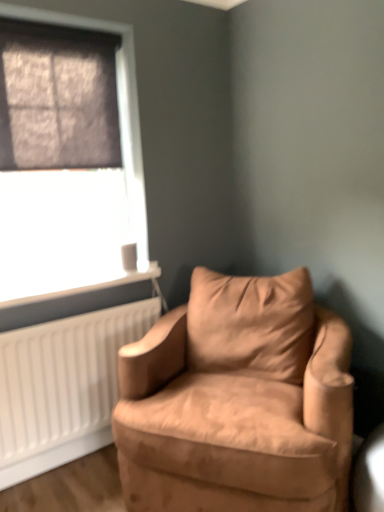
Question: Visually, is suede-like tan armchair at center positioned to the left or to the right of dark matte window screen at upper left?

Choices:
 (A) right
 (B) left

Answer: (A)

Question: Is suede-like tan armchair at center taller or shorter than dark matte window screen at upper left?

Choices:
 (A) short
 (B) tall

Answer: (B)

Question: Which is nearer to the dark matte window screen at upper left?

Choices:
 (A) white plastic radiator at lower left
 (B) matte black window at upper left
 (C) suede-like tan armchair at center

Answer: (B)

Question: Estimate the real-world distances between objects in this image. Which object is closer to the dark matte window screen at upper left?

Choices:
 (A) white plastic radiator at lower left
 (B) matte black window at upper left
 (C) suede-like tan armchair at center

Answer: (B)